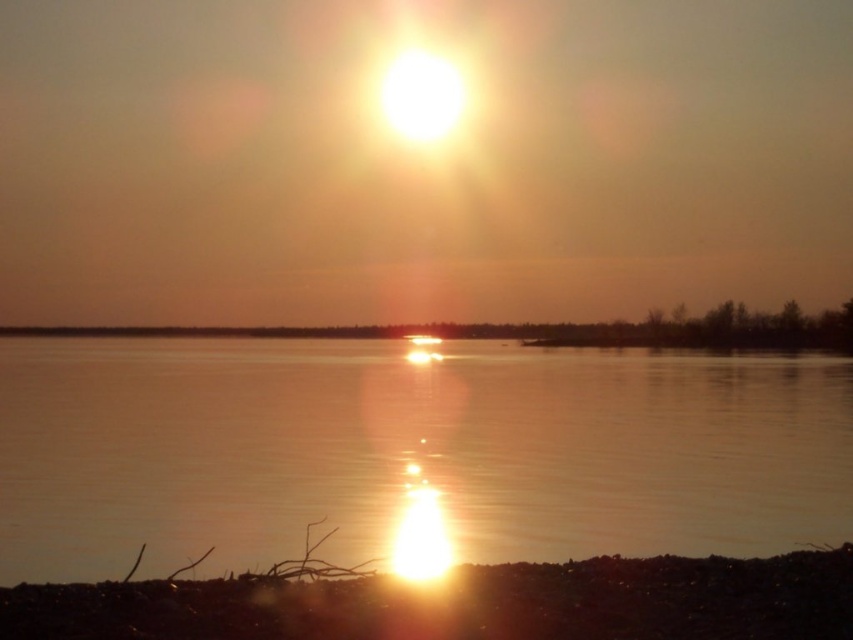
Question: Which point is closer to the camera taking this photo?

Choices:
 (A) (515, 339)
 (B) (846, 465)

Answer: (B)

Question: Can you confirm if translucent water at center is positioned to the left of smooth sand at center?

Choices:
 (A) no
 (B) yes

Answer: (A)

Question: Can you confirm if translucent water at center is positioned to the right of smooth sand at center?

Choices:
 (A) yes
 (B) no

Answer: (A)

Question: Can you confirm if translucent water at center is positioned below smooth sand at center?

Choices:
 (A) no
 (B) yes

Answer: (B)

Question: Which object is closer to the camera taking this photo?

Choices:
 (A) smooth sand at center
 (B) translucent water at center

Answer: (B)

Question: Which of the following is the farthest from the observer?

Choices:
 (A) (601, 340)
 (B) (500, 419)

Answer: (A)